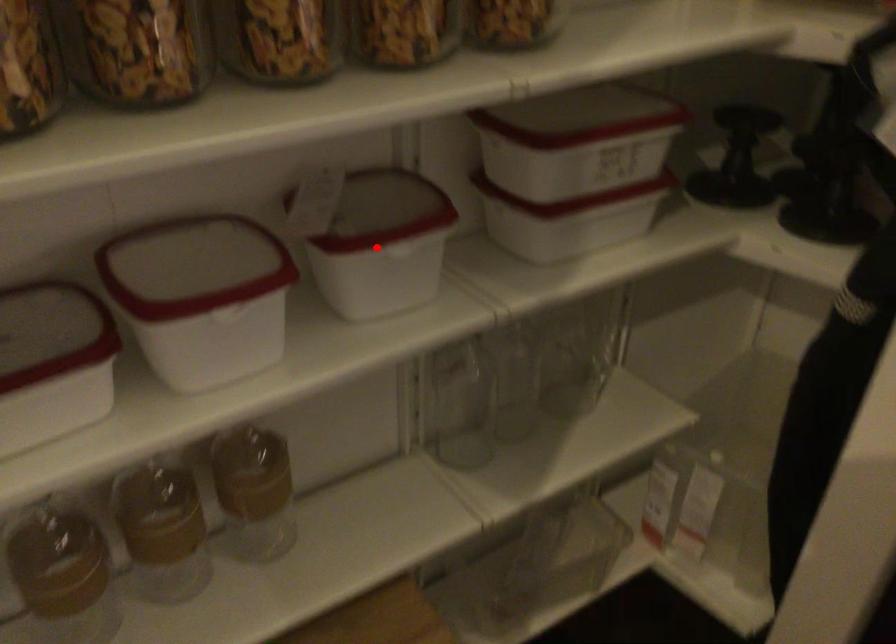
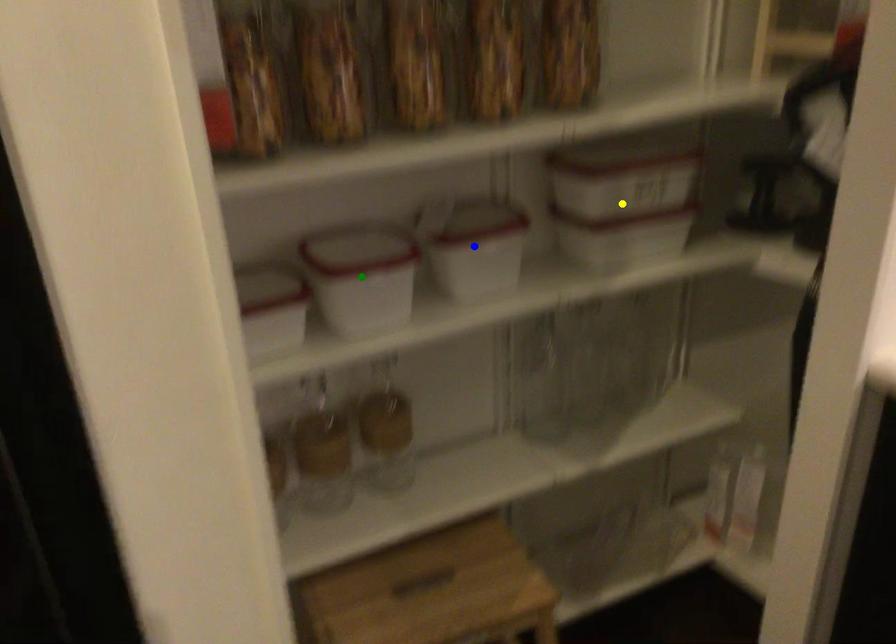
Question: I am providing you with two images of the same scene from different viewpoints. A red point is marked on the first image. You are given multiple points on the second image. Which spot in image 2 lines up with the point in image 1?

Choices:
 (A) yellow point
 (B) green point
 (C) blue point

Answer: (C)